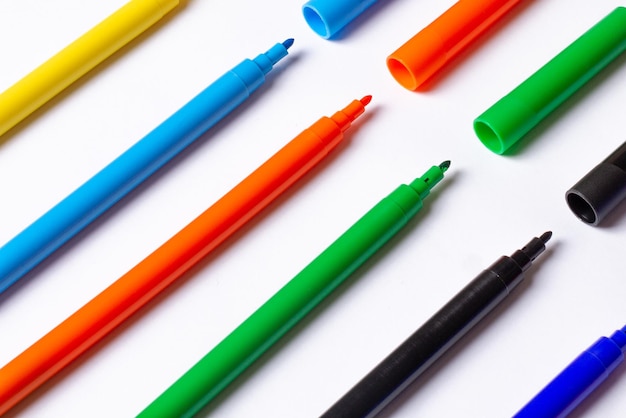
This screenshot has width=626, height=418. Identify the location of pens. (115, 34), (172, 128), (274, 186), (346, 240), (458, 314), (578, 392).